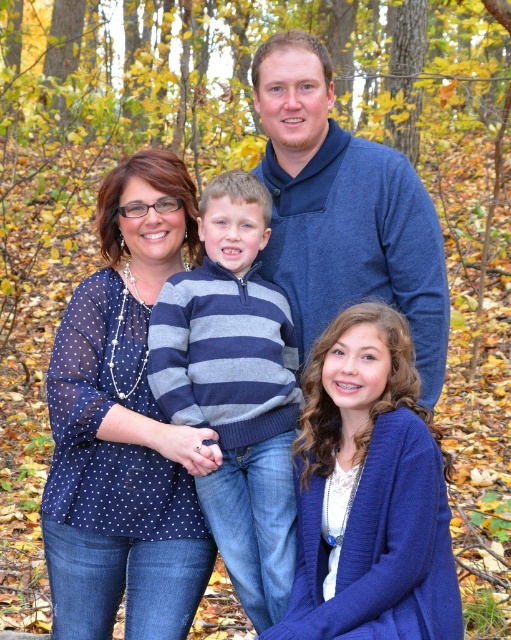
Question: Is striped knit sweater at center bigger than blue sweater at center?

Choices:
 (A) no
 (B) yes

Answer: (A)

Question: Estimate the real-world distances between objects in this image. Which object is farther from the blue knitted cardigan at lower right?

Choices:
 (A) blue sweater at center
 (B) striped knit sweater at center

Answer: (A)

Question: Which point appears closest to the camera in this image?

Choices:
 (A) (451, 593)
 (B) (187, 422)
 (C) (125, 314)

Answer: (A)

Question: Can you confirm if blue knitted cardigan at lower right is positioned to the left of striped knit sweater at center?

Choices:
 (A) no
 (B) yes

Answer: (A)

Question: Does striped knit sweater at center appear over blue sweater at center?

Choices:
 (A) no
 (B) yes

Answer: (A)

Question: Estimate the real-world distances between objects in this image. Which object is closer to the blue knitted cardigan at lower right?

Choices:
 (A) polka dot sheer blouse at center
 (B) blue sweater at center
 (C) striped knit sweater at center

Answer: (C)